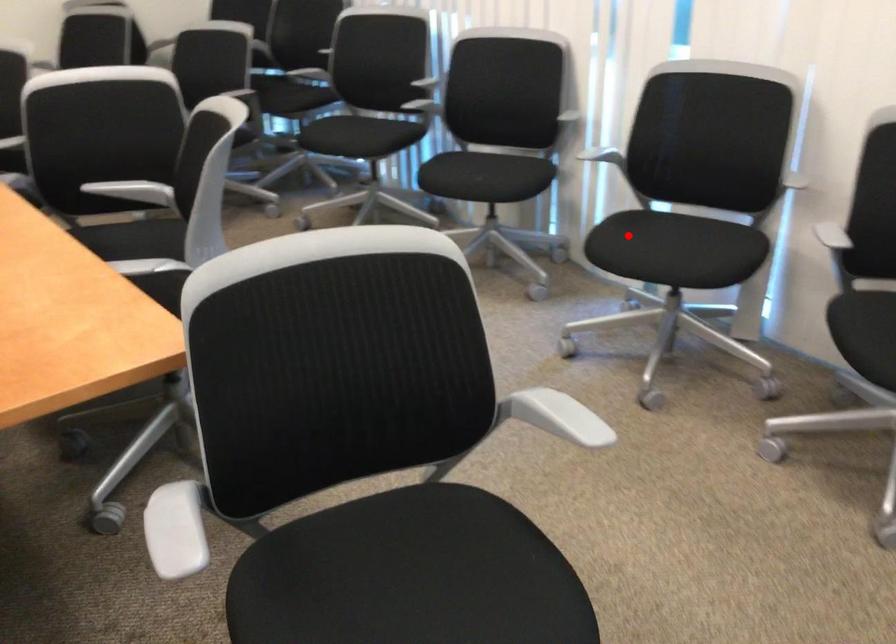
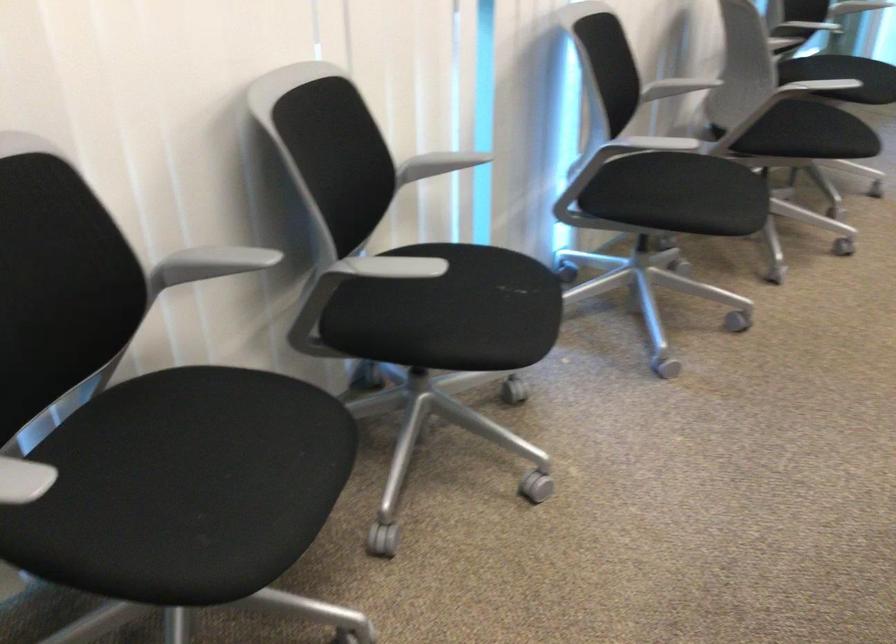
Locate, in the second image, the point that corresponds to the highlighted location in the first image.

(679, 194)